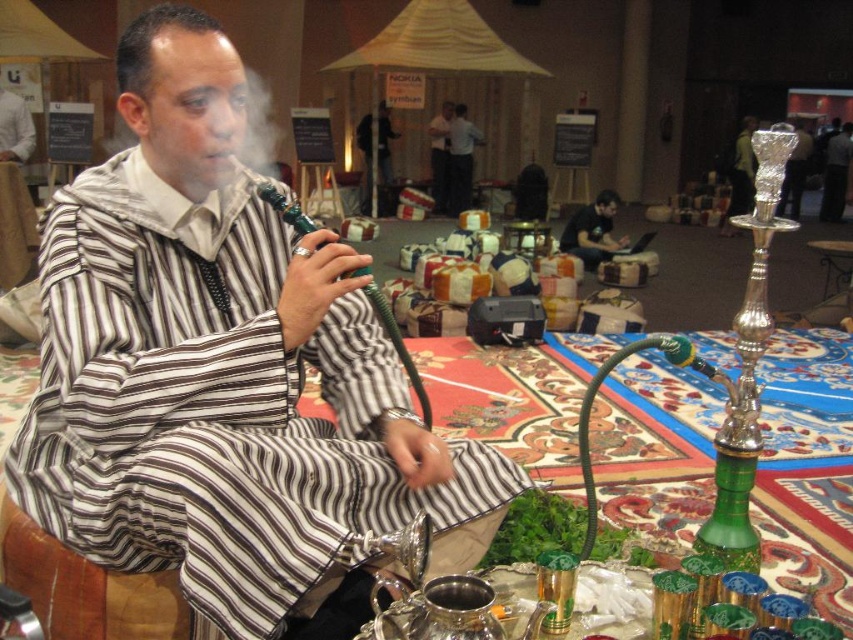
Does striped fabric man at center appear on the left side of dark blue fabric at center?

In fact, striped fabric man at center is to the right of dark blue fabric at center.

Image resolution: width=853 pixels, height=640 pixels. Describe the element at coordinates (222, 371) in the screenshot. I see `striped fabric man at center` at that location.

The width and height of the screenshot is (853, 640). Identify the location of striped fabric man at center. point(222,371).

Based on the photo, does striped fabric man at center have a greater height compared to matte black laptop at center?

Incorrect, striped fabric man at center's height is not larger of matte black laptop at center's.

Locate an element on the screen. Image resolution: width=853 pixels, height=640 pixels. striped fabric man at center is located at coordinates (x=222, y=371).

Locate an element on the screen. striped fabric man at center is located at coordinates (222, 371).

Does dark gray fabric shirt at center appear on the left side of dark blue fabric at center?

Incorrect, dark gray fabric shirt at center is not on the left side of dark blue fabric at center.

Based on the photo, measure the distance between dark gray fabric shirt at center and camera.

dark gray fabric shirt at center is 23.62 feet away from camera.

The image size is (853, 640). What do you see at coordinates (592, 230) in the screenshot? I see `dark gray fabric shirt at center` at bounding box center [592, 230].

Where is `dark gray fabric shirt at center`? This screenshot has height=640, width=853. dark gray fabric shirt at center is located at coordinates (592, 230).